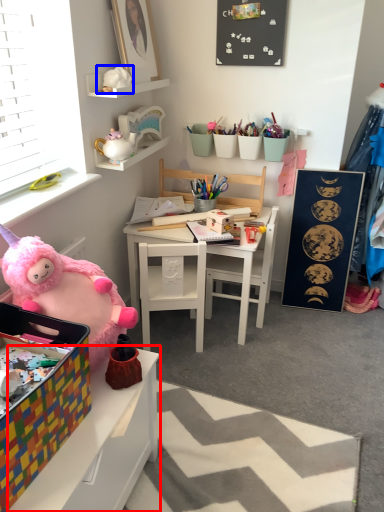
Question: Which point is further to the camera, table (highlighted by a red box) or toy (highlighted by a blue box)?

Choices:
 (A) table
 (B) toy

Answer: (B)